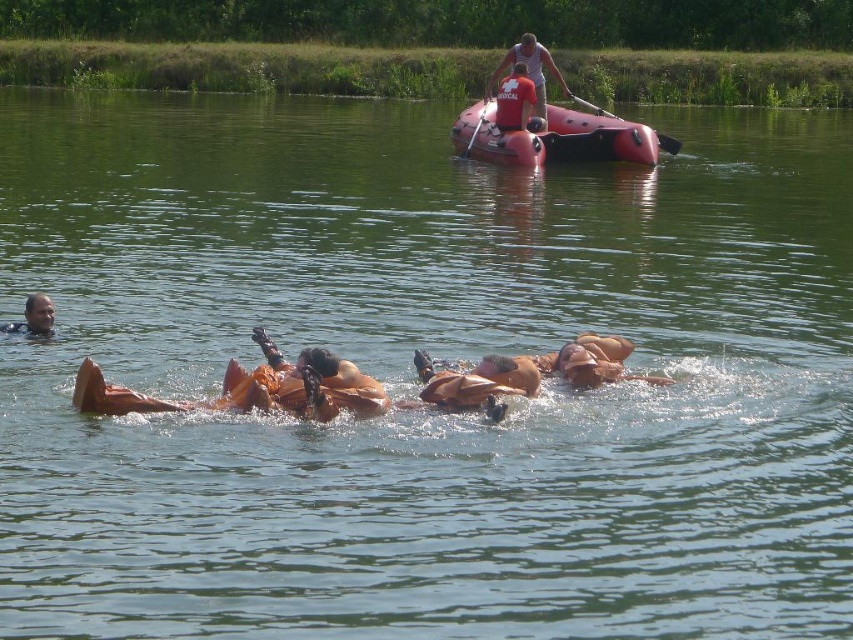
You are a participant in the water exercise and need to retrieve the rubber paddle at upper center. You are currently holding the matte orange life vest at lower left. Which direction should you move to reach the paddle?

The matte orange life vest at lower left is to the left of the rubber paddle at upper center, so you should move to your right to reach the paddle.

You are a lifeguard assessing the equipment in the scene. You notice two red life preservers labeled as a matte red life vest at upper center and a red matte life jacket at upper center. Which one is bigger?

The matte red life vest at upper center is larger in size than the red matte life jacket at upper center.

You are a drone operator assigned to monitor the rescue exercise. Your task is to locate the matte red life vest at upper center. What are its coordinates?

The matte red life vest at upper center is located at coordinates point (x=529, y=68).